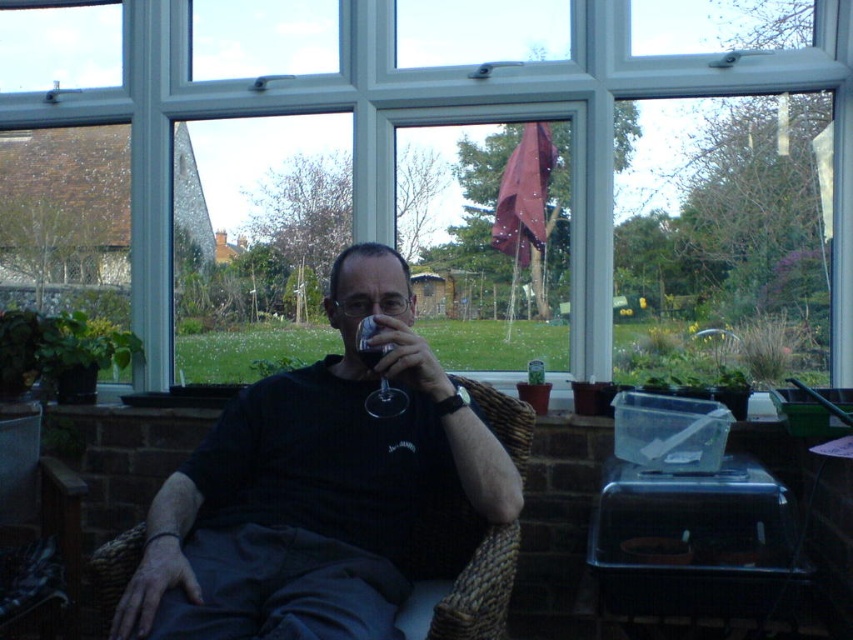
Question: Can you confirm if black matte shirt at center is positioned to the right of translucent glass wine at center?

Choices:
 (A) yes
 (B) no

Answer: (B)

Question: Is the position of brown woven armchair at lower left more distant than that of transparent glass at center?

Choices:
 (A) yes
 (B) no

Answer: (A)

Question: Which point appears closest to the camera in this image?

Choices:
 (A) (370, 346)
 (B) (49, 3)
 (C) (198, 458)

Answer: (A)

Question: Which object is positioned closest to the transparent glass window at center?

Choices:
 (A) translucent glass wine at center
 (B) transparent glass at center
 (C) black matte shirt at center

Answer: (C)

Question: Which object is positioned closest to the transparent glass window at center?

Choices:
 (A) brown woven armchair at lower left
 (B) black matte shirt at center

Answer: (A)

Question: Does transparent glass window at center appear on the left side of brown woven armchair at lower left?

Choices:
 (A) yes
 (B) no

Answer: (B)